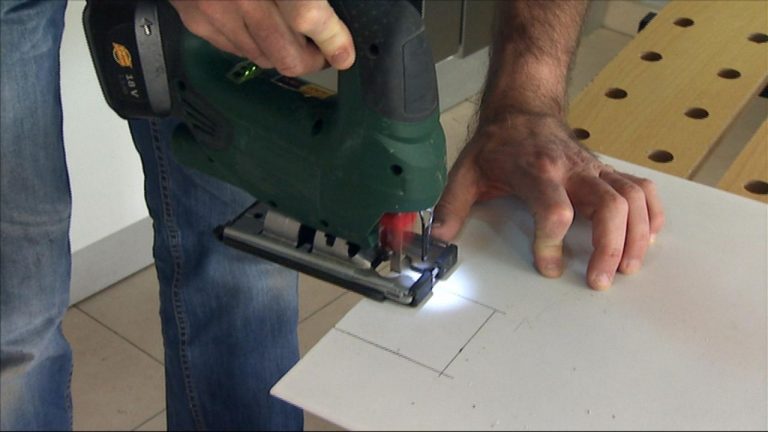
Find the location of a particular element. board is located at coordinates (686, 64).